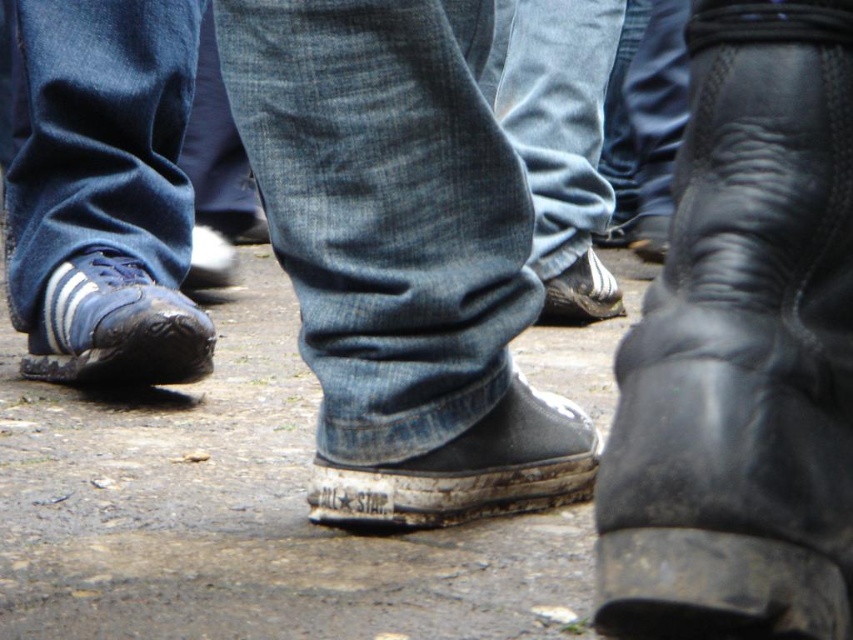
You are a photographer trying to capture a detailed shot of the denim at left and the blue denim jeans at left. Which object should you focus on first if you want to ensure both are in focus without adjusting the camera settings?

The denim at left is below blue denim jeans at left, so focusing on the blue denim jeans at left first would help keep both in focus since it is closer to the camera.

Looking at this image, you are standing in an urban area and notice a point marked at coordinates (241, 513). Based on the scene description, what type of surface does this point most likely represent?

The point at coordinates (241, 513) corresponds to dull concrete pavement at center, as stated in the Objects Description.

You are standing on the dull concrete pavement at center and want to kick a small stone that is near the blue suede sneaker at left. Can you reach it without moving your feet?

The dull concrete pavement at center is to the right of blue suede sneaker at left, so you can reach the stone by moving your foot to the left towards the blue suede sneaker at left.